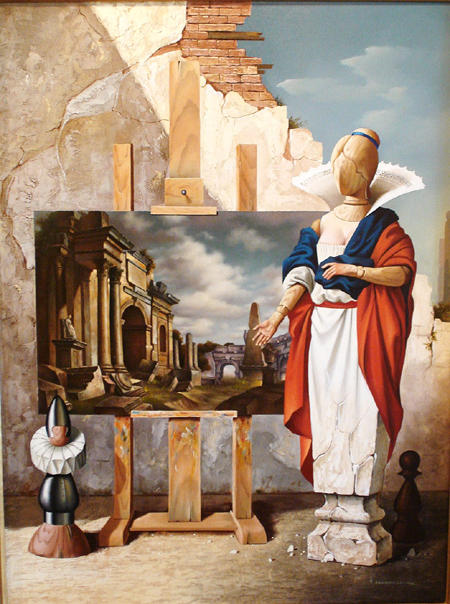
Where is `white wall`? white wall is located at coordinates (133, 22).